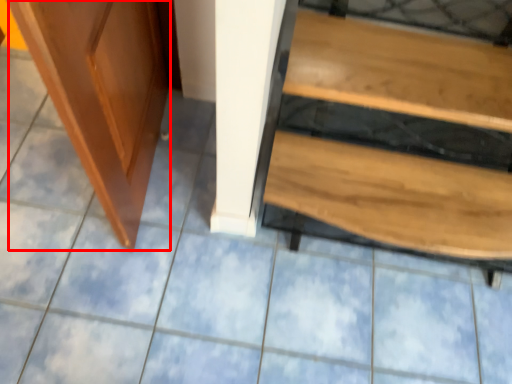
Question: From the image's perspective, where is screen door (annotated by the red box) located in relation to furniture in the image?

Choices:
 (A) above
 (B) below

Answer: (A)